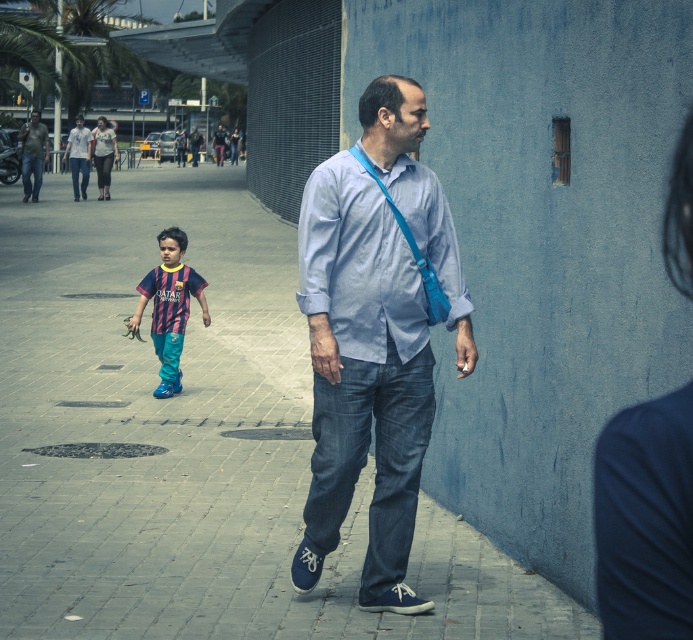
Based on the scene description, which object occupies a larger area in the image? The brick pavement at center or the matte green shirt at upper left?

The brick pavement at center is bigger than matte green shirt at upper left, so the brick pavement at center occupies a larger area in the image.

You are a tailor measuring a man for alterations. You notice the blue denim jeans at center and the light blue cotton shirt at center. Which garment might require adjustments for a better fit?

Answer: The blue denim jeans at center might be wider than the light blue cotton shirt at center, so the jeans might need alterations to achieve a more tailored fit.

Based on the scene description, where is the brick pavement at center located in relation to the matte green shirt at upper left?

The brick pavement at center is to the right of the matte green shirt at upper left.